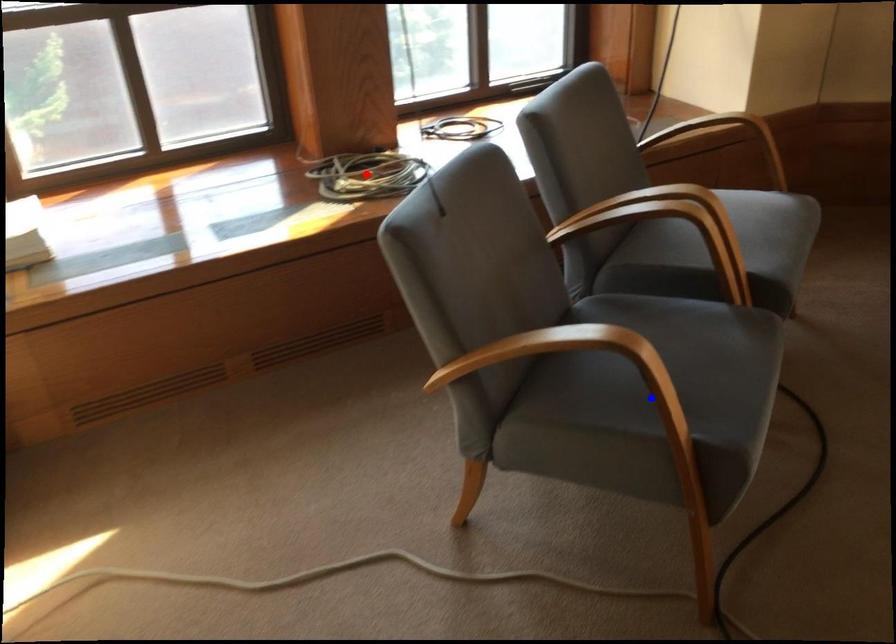
Question: Two points are marked on the image. Which point is closer to the camera?

Choices:
 (A) Blue point is closer.
 (B) Red point is closer.

Answer: (A)